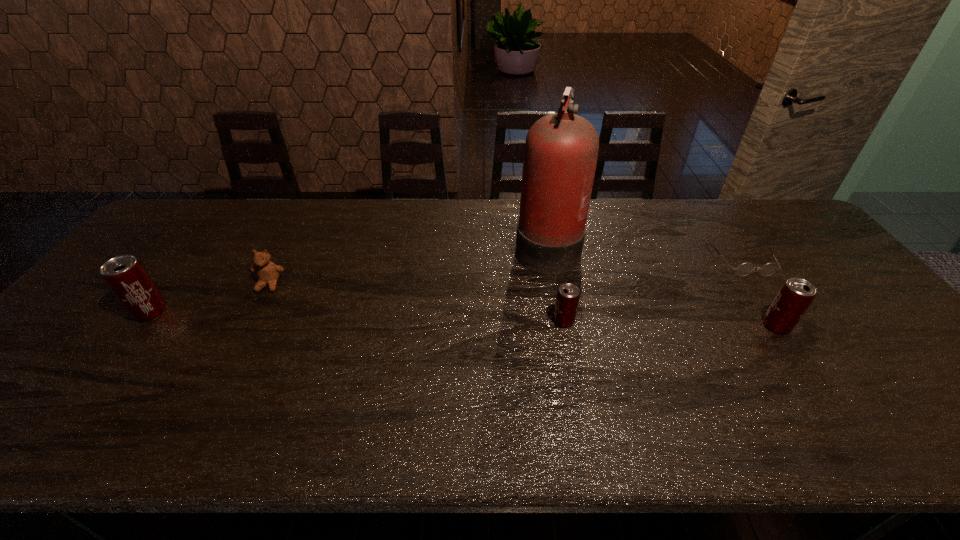
Please point a space for a new beer_can to maintain equal intervals. Please provide its 2D coordinates. Your answer should be formatted as a tuple, i.e. [(x, y)], where the tuple contains the x and y coordinates of a point satisfying the conditions above.

[(355, 316)]